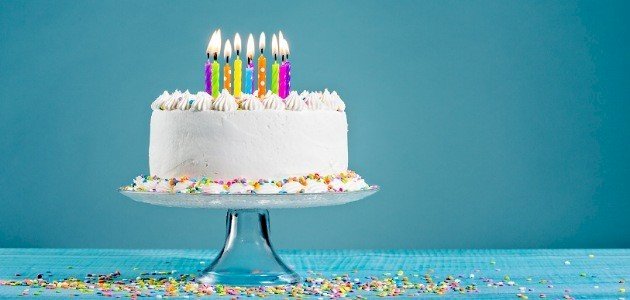
The image size is (630, 300). I want to click on candle wicks, so click(208, 57), click(215, 57), click(225, 57), click(237, 50), click(248, 60), click(261, 48), click(273, 56), click(284, 57), click(287, 57).